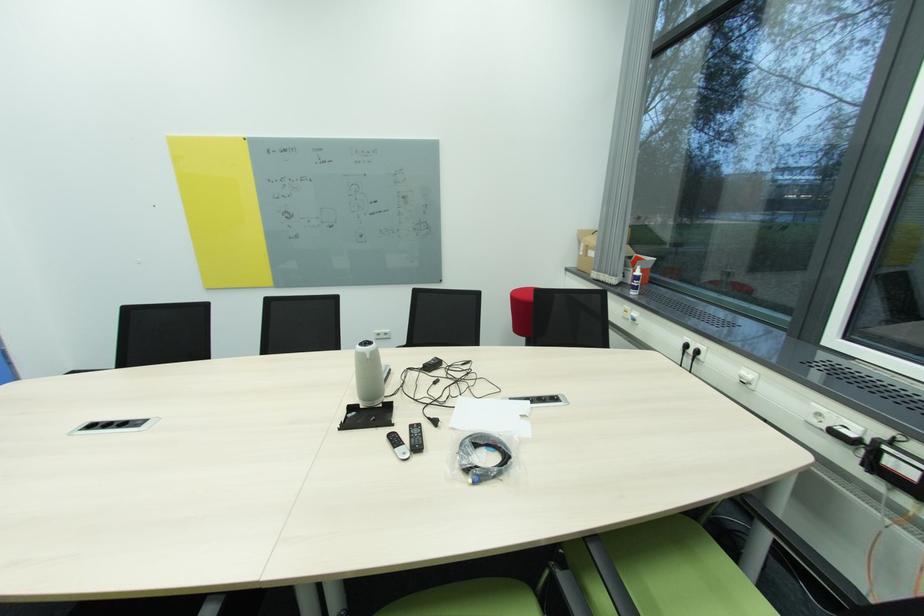
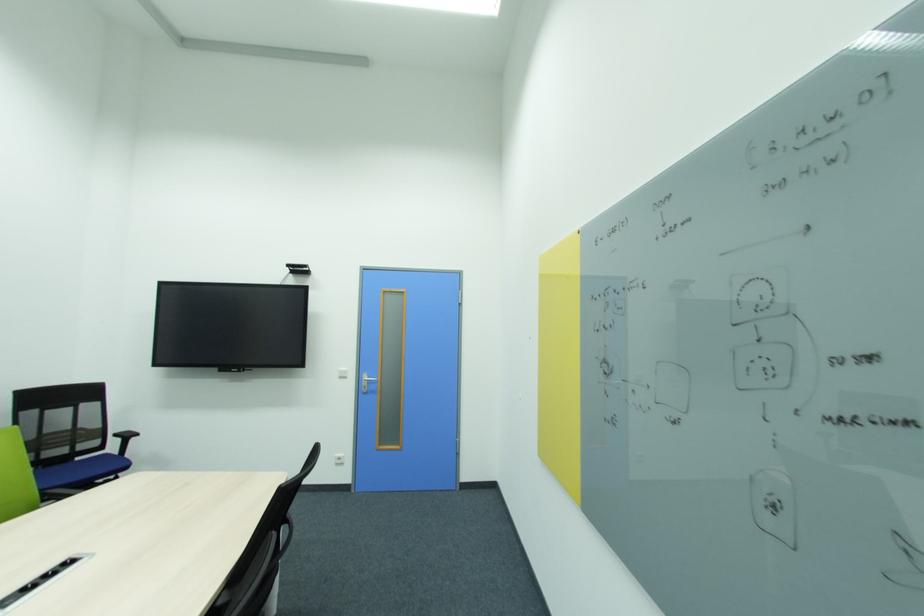
Locate, in the second image, the point that corresponds to point (290, 214) in the first image.

(610, 362)